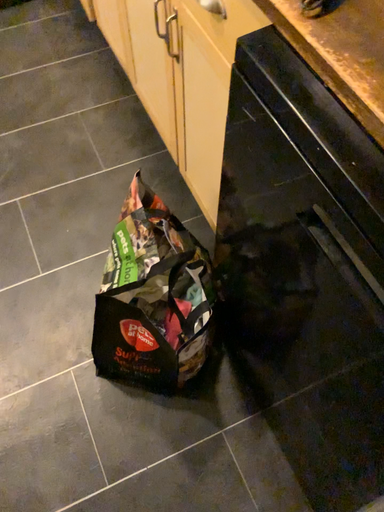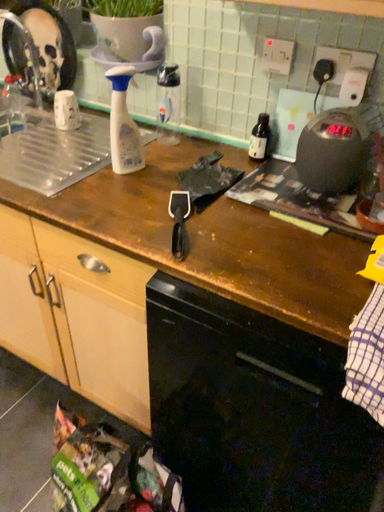
Question: Which way did the camera rotate in the video?

Choices:
 (A) rotated downward
 (B) rotated upward

Answer: (B)